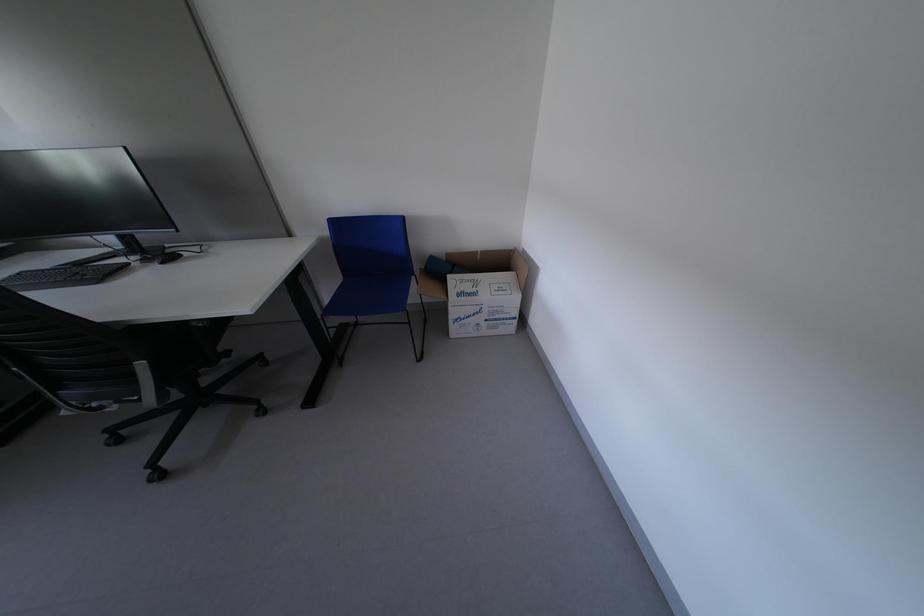
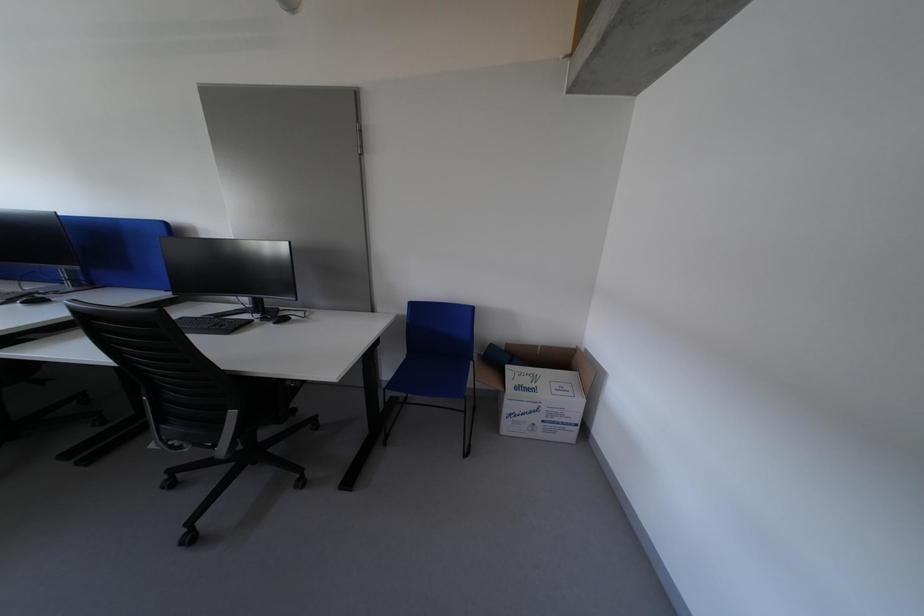
From the picture: Which direction would the cameraman need to move to produce the second image?

The movement direction of the cameraman is left, backward.